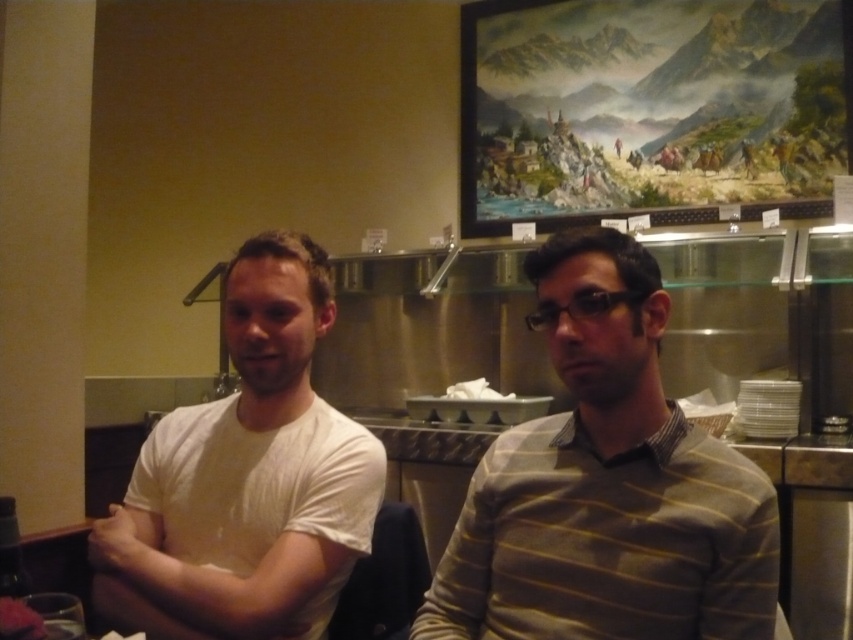
You are a customer in the restaurant and want to place your phone on the nearest available surface. There are two points marked in the scene. One is at coordinates point (660, 500) and the other at point (250, 592). Which point should you choose to ensure your phone is closer to you?

Point (660, 500) is in front of point (250, 592), so placing the phone there would be closer to you.